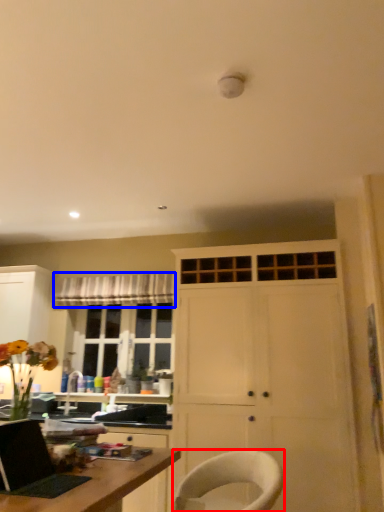
Question: Which object is closer to the camera taking this photo, chair (highlighted by a red box) or curtain (highlighted by a blue box)?

Choices:
 (A) chair
 (B) curtain

Answer: (A)